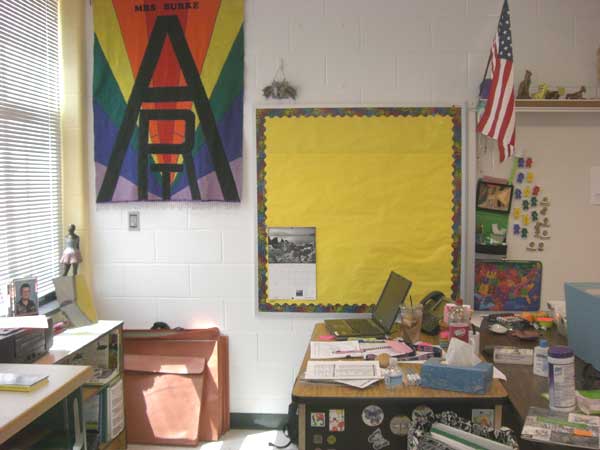
At what (x,y) coordinates should I click in order to perform the action: click on teacher's desk. Please return your answer as a coordinate pair (x, y). The height and width of the screenshot is (450, 600). Looking at the image, I should click on (309, 388).